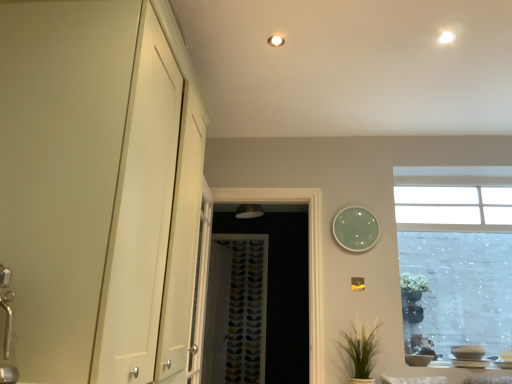
Question: From a real-world perspective, is white glossy light fixture at upper center, positioned as the 1th lighting in left-to-right order, beneath multicolored fabric curtain at center?

Choices:
 (A) no
 (B) yes

Answer: (A)

Question: Is the depth of white glossy light fixture at upper center, arranged as the 2th lighting when viewed from the right, greater than that of multicolored fabric curtain at center?

Choices:
 (A) yes
 (B) no

Answer: (B)

Question: From the image's perspective, does white glossy light fixture at upper center, positioned as the 1th lighting in left-to-right order, appear higher than multicolored fabric curtain at center?

Choices:
 (A) no
 (B) yes

Answer: (B)

Question: Does white glossy light fixture at upper center, placed as the second lighting when sorted from front to back, have a smaller size compared to multicolored fabric curtain at center?

Choices:
 (A) no
 (B) yes

Answer: (B)

Question: Can you confirm if white glossy light fixture at upper center, arranged as the 2th lighting when viewed from the right, is positioned to the left of multicolored fabric curtain at center?

Choices:
 (A) no
 (B) yes

Answer: (A)

Question: Is white glossy light fixture at upper center, placed as the second lighting when sorted from front to back, shorter than multicolored fabric curtain at center?

Choices:
 (A) no
 (B) yes

Answer: (B)

Question: Is green matte plant at lower right next to white glossy light fixture at upper right, arranged as the second lighting when viewed from the back, and touching it?

Choices:
 (A) yes
 (B) no

Answer: (B)

Question: Is green matte plant at lower right further to the viewer compared to white glossy light fixture at upper right, acting as the second lighting starting from the left?

Choices:
 (A) yes
 (B) no

Answer: (A)

Question: Does green matte plant at lower right have a smaller size compared to white glossy light fixture at upper right, which is the 1th lighting in front-to-back order?

Choices:
 (A) no
 (B) yes

Answer: (A)

Question: Can white glossy light fixture at upper right, acting as the second lighting starting from the left, be found inside green matte plant at lower right?

Choices:
 (A) yes
 (B) no

Answer: (B)

Question: Could you tell me if green matte plant at lower right is facing white glossy light fixture at upper right, the 1th lighting from the right?

Choices:
 (A) no
 (B) yes

Answer: (A)

Question: Can you confirm if green matte plant at lower right is shorter than white glossy light fixture at upper right, acting as the second lighting starting from the left?

Choices:
 (A) yes
 (B) no

Answer: (B)

Question: Is white glossy light fixture at upper right, acting as the second lighting starting from the left, at the left side of white glossy cabinet at left?

Choices:
 (A) yes
 (B) no

Answer: (B)